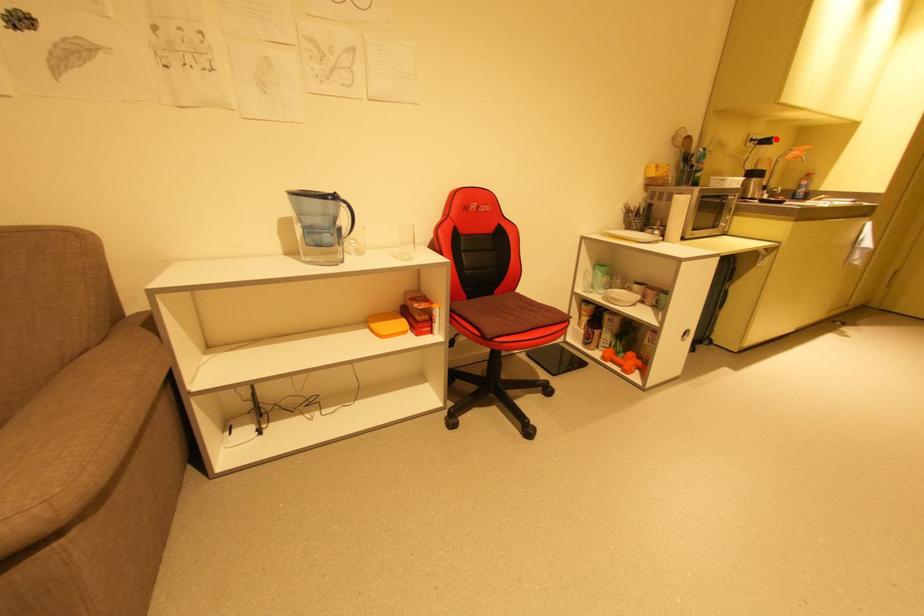
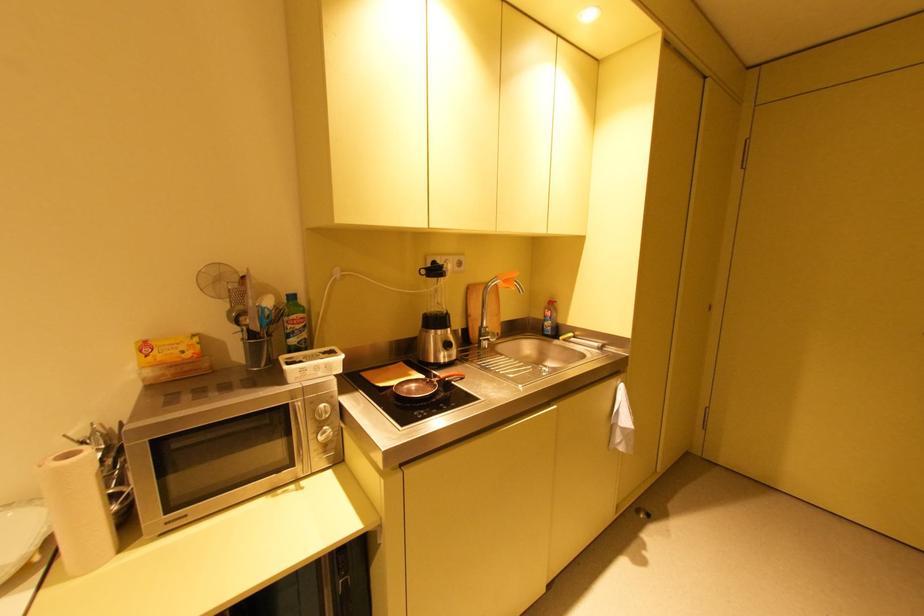
The point at the highlighted location is marked in the first image. Where is the corresponding point in the second image?

(444, 267)